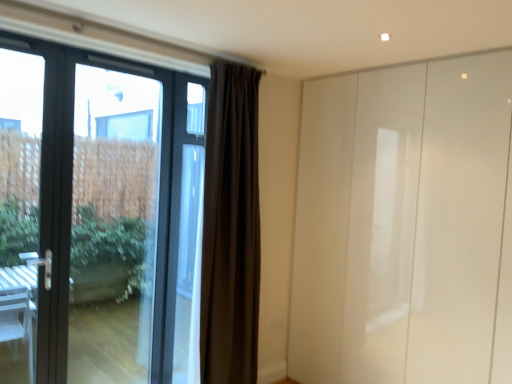
Question: Considering their positions, is dark matte curtain at center located in front of or behind transparent glass door at left?

Choices:
 (A) front
 (B) behind

Answer: (B)

Question: Based on their sizes in the image, would you say dark matte curtain at center is bigger or smaller than transparent glass door at left?

Choices:
 (A) small
 (B) big

Answer: (B)

Question: Which object is the farthest from the glossy white wardrobe at right?

Choices:
 (A) matte black door at left
 (B) dark matte curtain at center
 (C) transparent glass door at left

Answer: (A)

Question: Which object is the farthest from the glossy white wardrobe at right?

Choices:
 (A) transparent glass door at left
 (B) matte black door at left
 (C) dark matte curtain at center

Answer: (B)